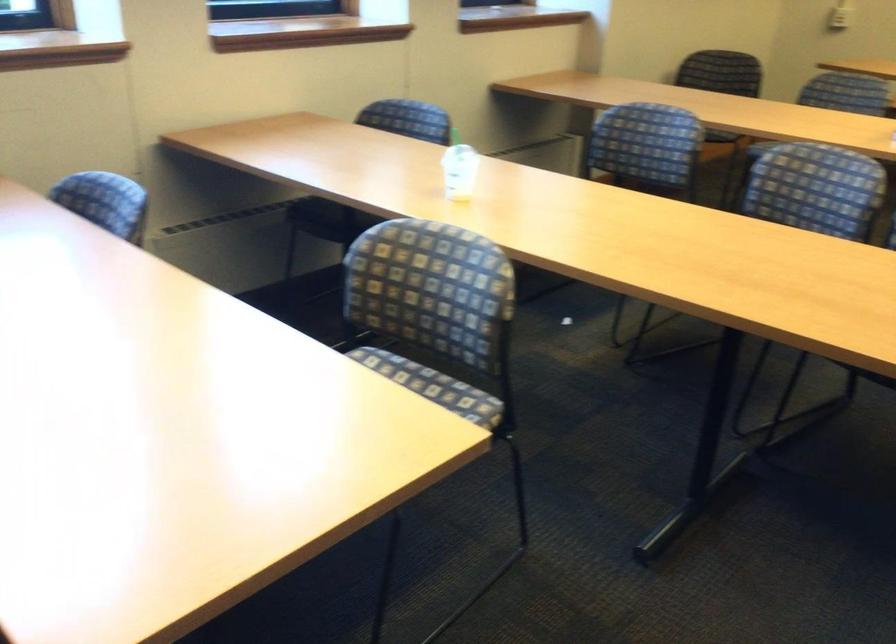
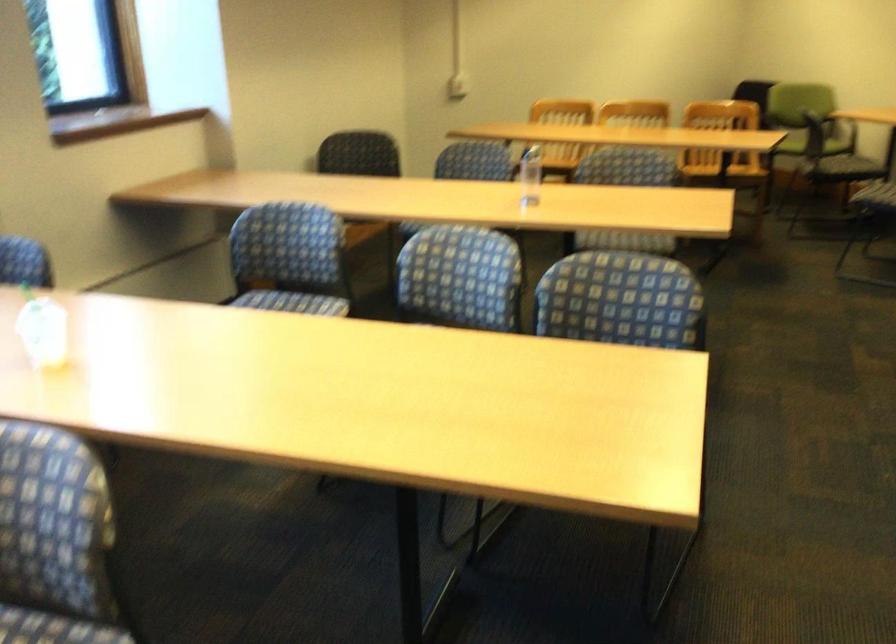
Question: The camera is either moving clockwise (left) or counter-clockwise (right) around the object. The first image is from the beginning of the video and the second image is from the end. Is the camera moving left or right when shooting the video?

Choices:
 (A) Left
 (B) Right

Answer: (A)